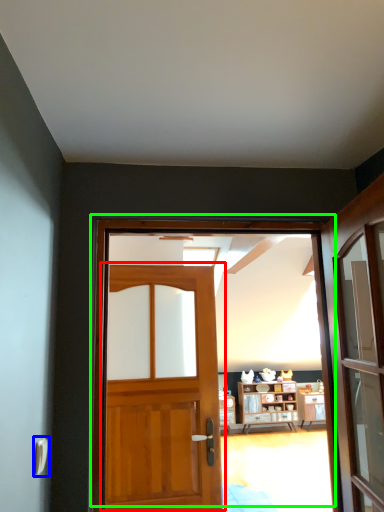
Question: Which is farther away from door (highlighted by a red box)? door handle (highlighted by a blue box) or door (highlighted by a green box)?

Choices:
 (A) door handle
 (B) door

Answer: (B)